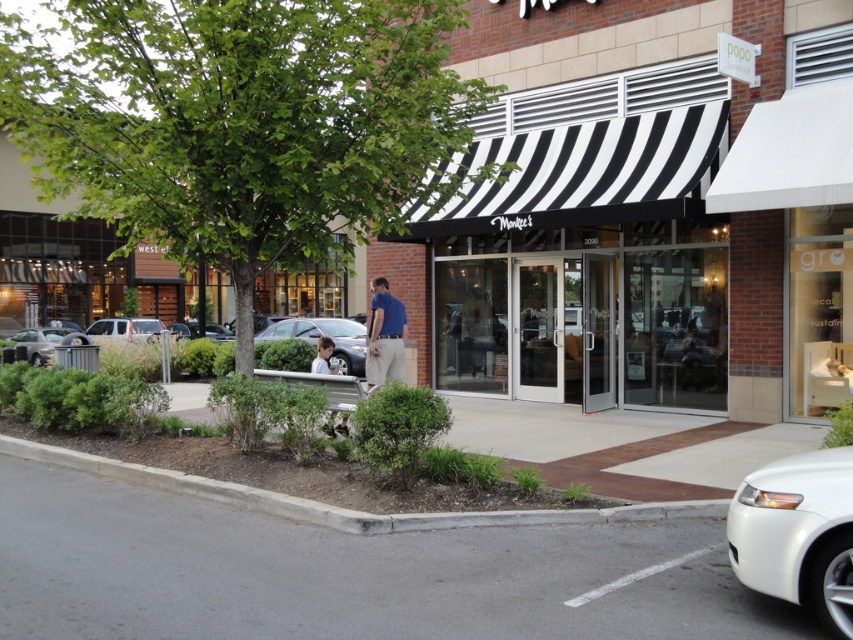
Question: Which object is the closest to the blue cotton shirt at center?

Choices:
 (A) black and white striped awning at center
 (B) matte gray car at left

Answer: (A)

Question: Can you confirm if white glossy sedan at lower right is wider than gray concrete curb at lower left?

Choices:
 (A) yes
 (B) no

Answer: (A)

Question: Which point is farther from the camera taking this photo?

Choices:
 (A) (585, 516)
 (B) (753, 538)
 (C) (7, 337)

Answer: (C)

Question: Is black and white striped awning at center wider than white glossy sedan at lower right?

Choices:
 (A) yes
 (B) no

Answer: (A)

Question: Is black and white striped awning at center bigger than silver metallic car at center?

Choices:
 (A) yes
 (B) no

Answer: (A)

Question: Which object is the closest to the gray concrete curb at lower left?

Choices:
 (A) black and white striped awning at center
 (B) silver metallic car at center
 (C) light blue shirt at center
 (D) matte gray car at left

Answer: (C)